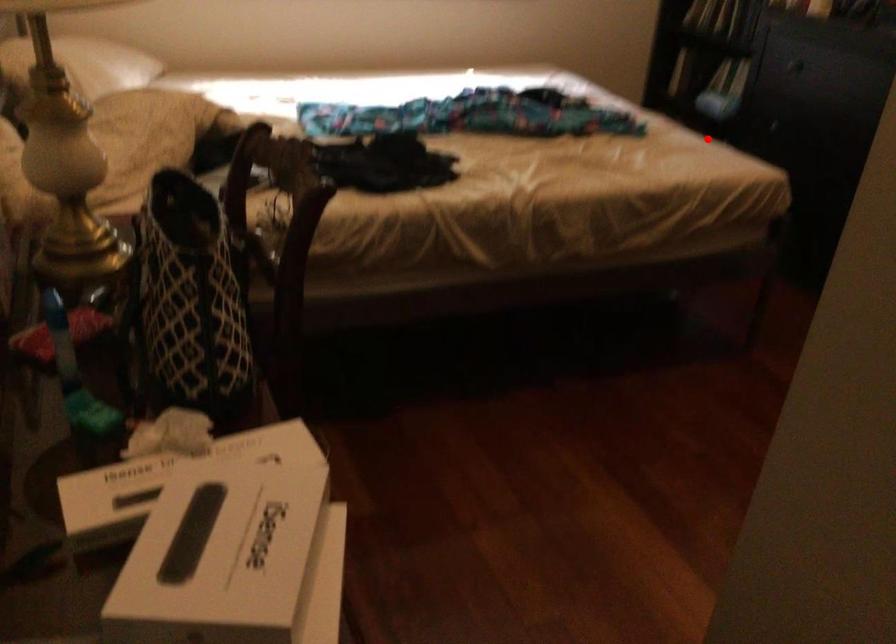
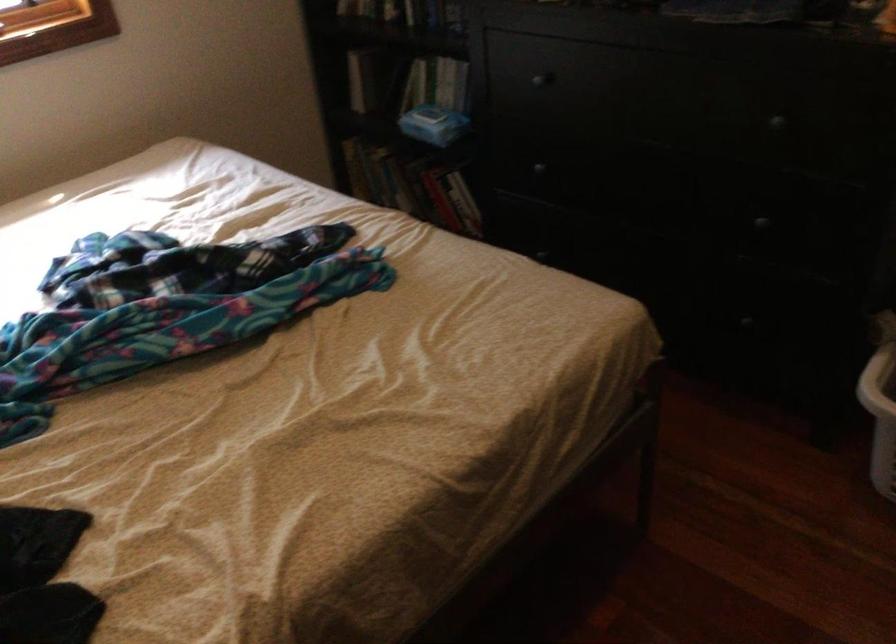
Question: I am providing you with two images of the same scene from different viewpoints. In image1, a red point is highlighted. Considering the same 3D point in image2, which of the following is correct?

Choices:
 (A) It is closer
 (B) It is farther

Answer: (A)